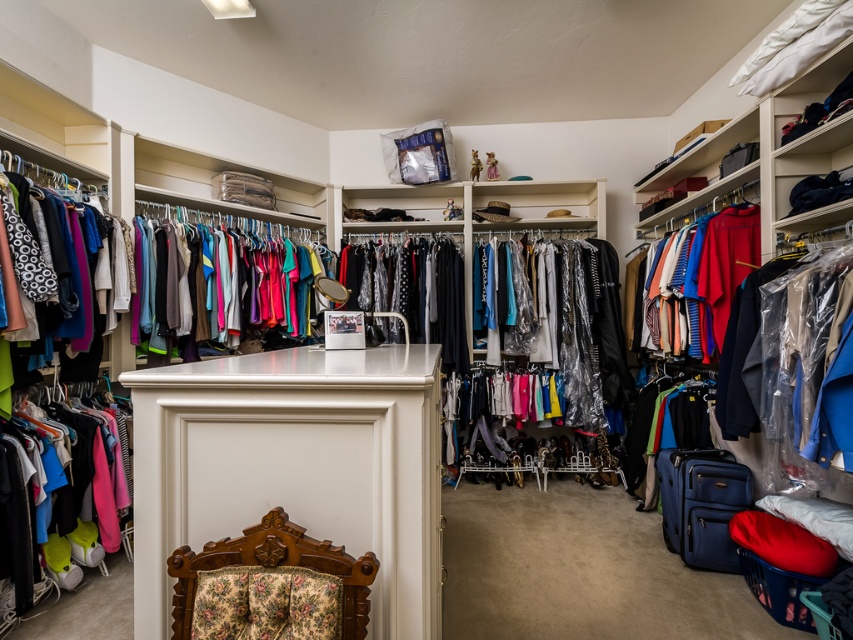
You are organizing your closet and want to place a new accessory on the shelf above the matte pink fabric clothing at lower left and the matte black dress at center. Which clothing item should you consider the shelf position relative to?

The shelf should be positioned above the matte pink fabric clothing at lower left because it is located below the matte black dress at center, meaning the shelf above the pink clothing would also be above the dress.